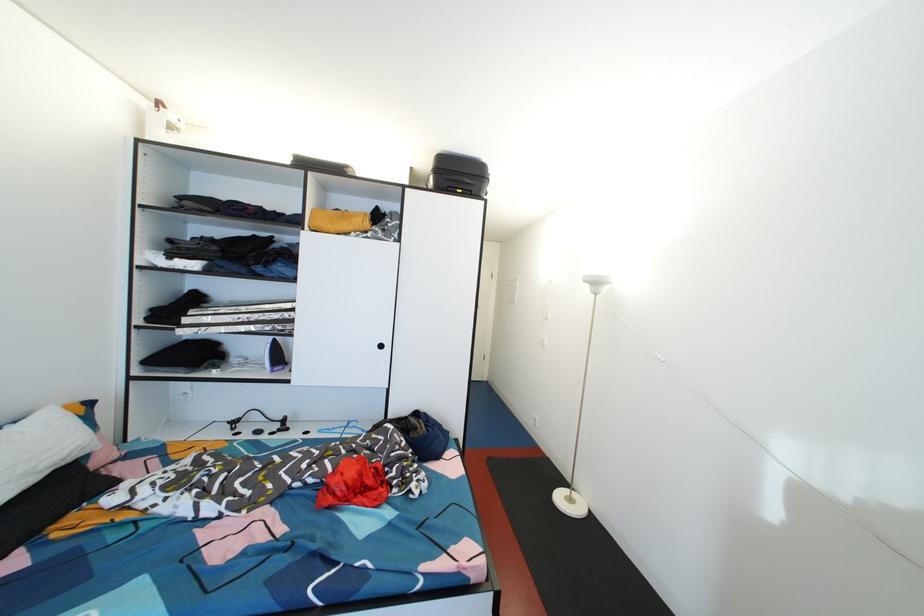
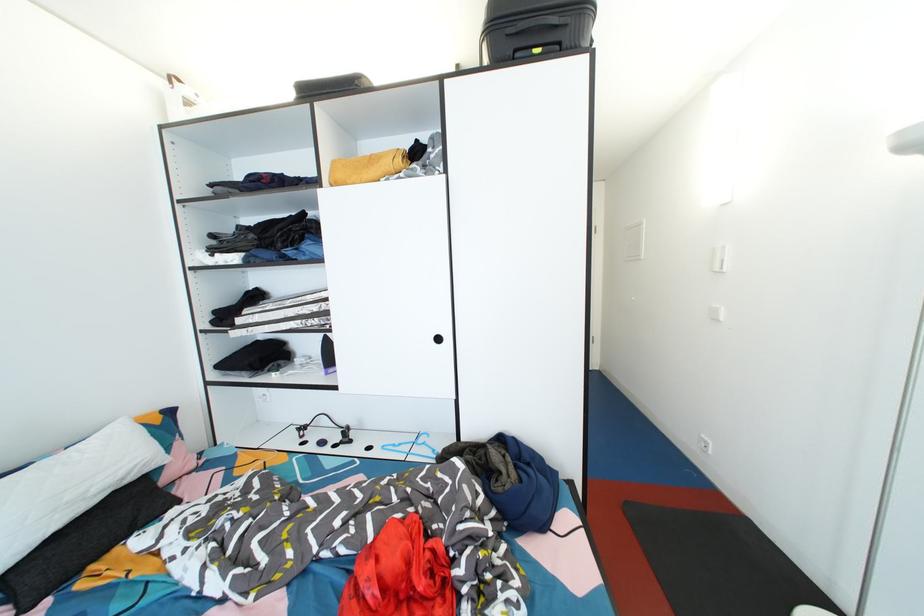
Question: Which direction would the cameraman need to move to produce the second image? Reply with the corresponding letter.

Choices:
 (A) Left
 (B) Right
 (C) Forward
 (D) Backward

Answer: (C)